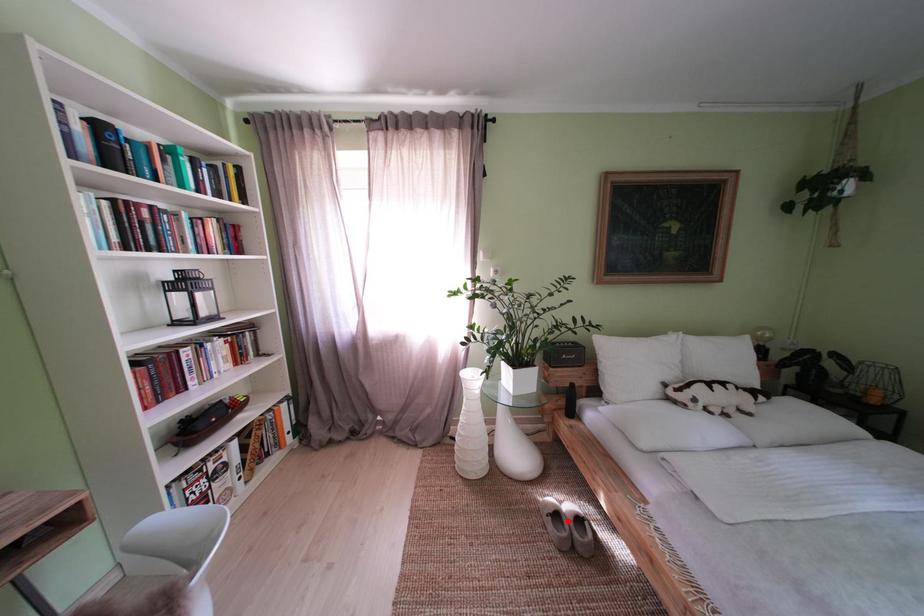
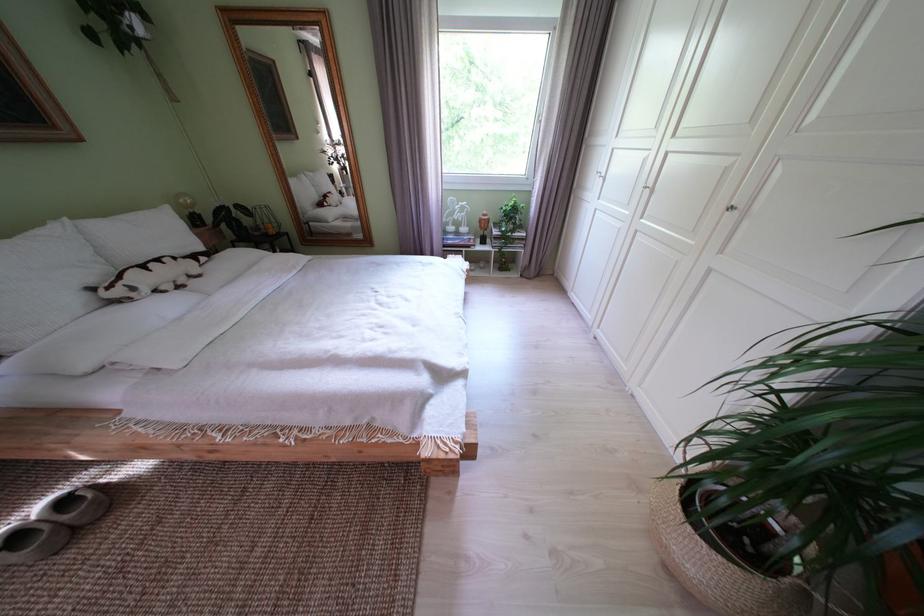
Question: I am providing you with two images of the same scene from different viewpoints. Given a red point in image1, look at the same physical point in image2. Is it:

Choices:
 (A) Closer to the viewpoint
 (B) Farther from the viewpoint

Answer: (A)